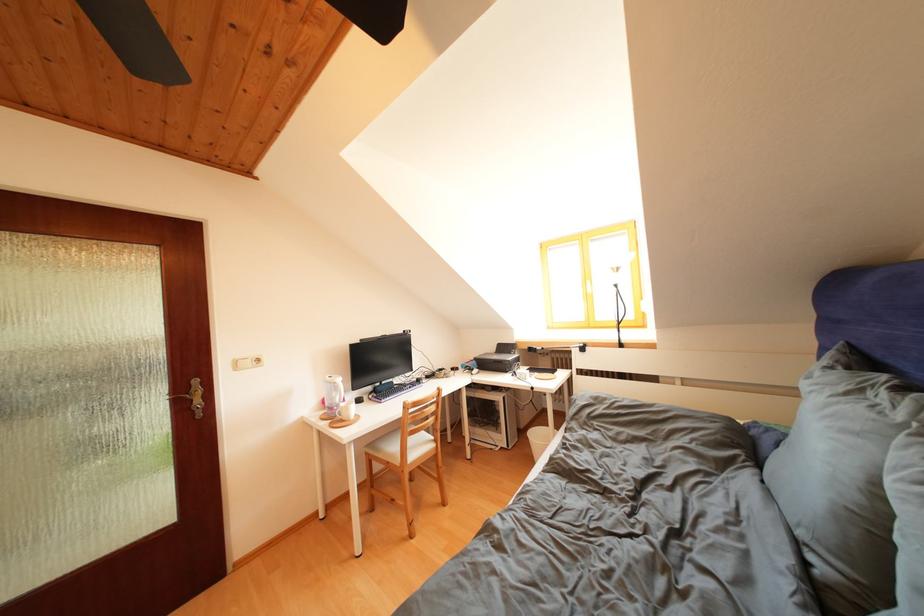
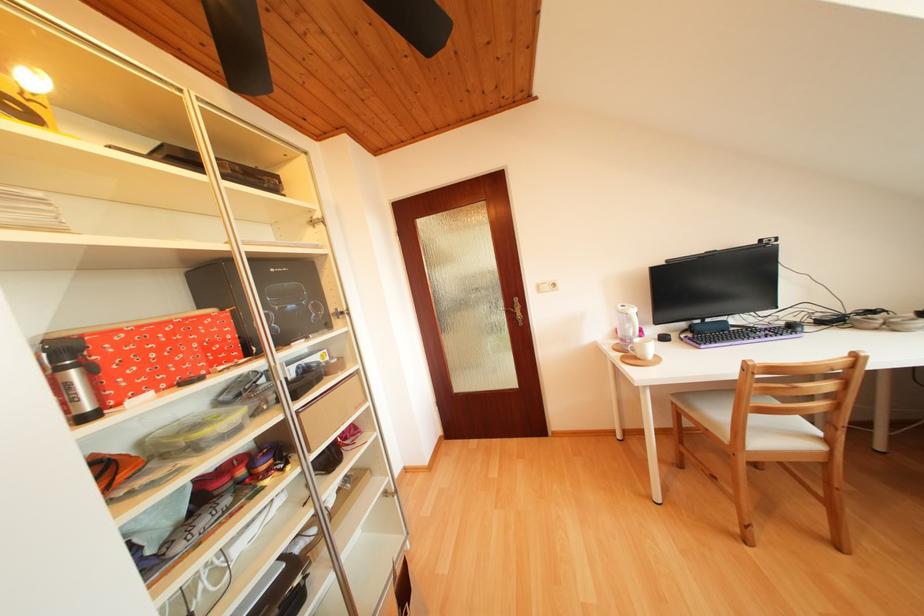
Question: How did the camera likely rotate?

Choices:
 (A) Left
 (B) Right
 (C) Up
 (D) Down

Answer: (A)